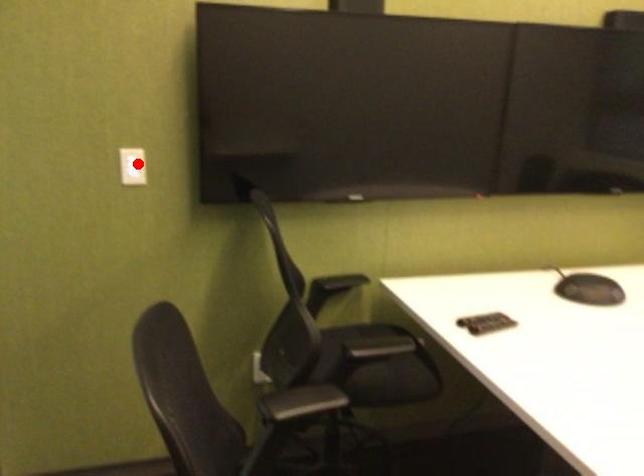
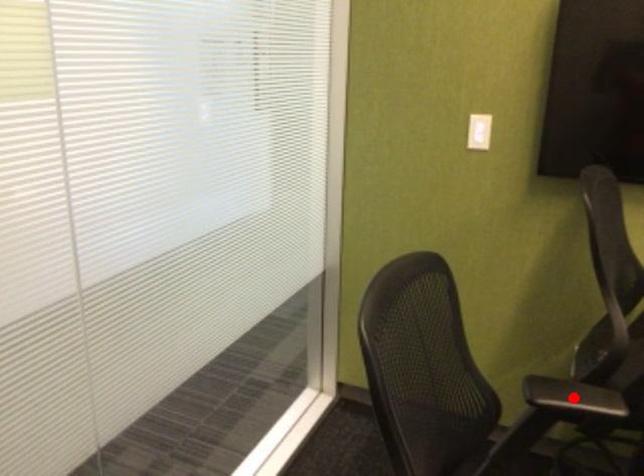
I am providing you with two images of the same scene from different viewpoints. A red point is marked on the first image and another point is marked on the second image. Does the point marked in image1 correspond to the same location as the one in image2?

No